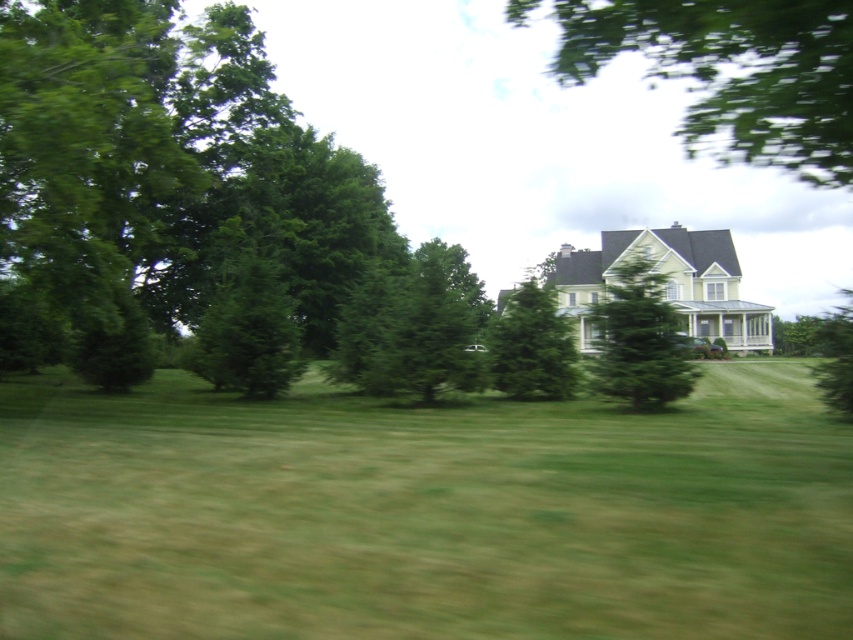
Is green leafy tree at upper center wider than green textured tree at center?

Correct, the width of green leafy tree at upper center exceeds that of green textured tree at center.

Is green leafy tree at upper center taller than green textured tree at center?

Yes.

The width and height of the screenshot is (853, 640). I want to click on green leafy tree at upper center, so click(735, 74).

Find the location of a particular element. The height and width of the screenshot is (640, 853). green leafy tree at upper center is located at coordinates (735, 74).

Who is higher up, green grass at center or green textured evergreen tree at center?

green textured evergreen tree at center is above.

Does green grass at center appear on the right side of green textured evergreen tree at center?

Incorrect, green grass at center is not on the right side of green textured evergreen tree at center.

The image size is (853, 640). What do you see at coordinates (422, 513) in the screenshot? I see `green grass at center` at bounding box center [422, 513].

Identify the location of green grass at center. The width and height of the screenshot is (853, 640). (422, 513).

Does green textured tree at center appear under green textured evergreen tree at center?

No, green textured tree at center is not below green textured evergreen tree at center.

Which is behind, point (625, 305) or point (543, 387)?

Positioned behind is point (543, 387).

Identify the location of green textured tree at center. The image size is (853, 640). (637, 340).

The image size is (853, 640). I want to click on green textured tree at center, so click(x=637, y=340).